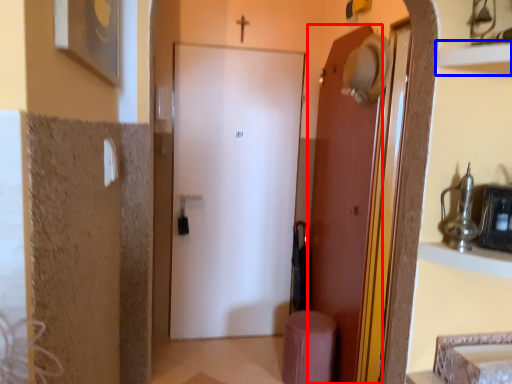
Question: Which of the following is the farthest to the observer, door (highlighted by a red box) or shelf (highlighted by a blue box)?

Choices:
 (A) door
 (B) shelf

Answer: (A)